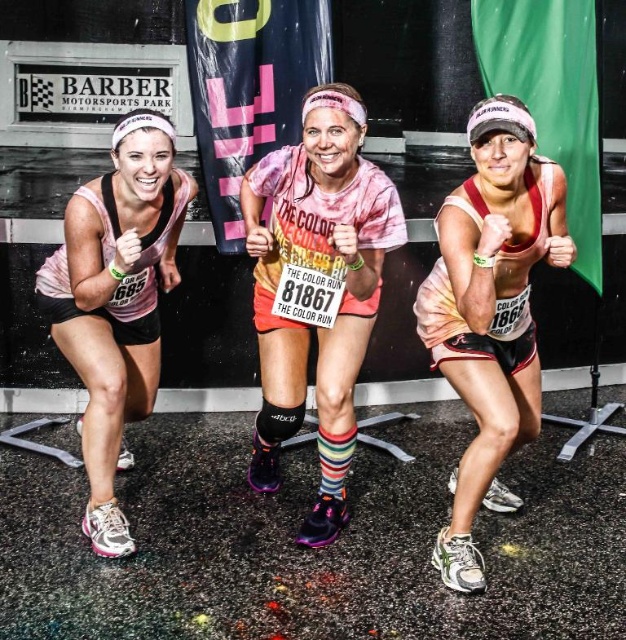
Is matte tie-dye tank top at center behind pink tie-dye tank top at left?

No.

Does matte tie-dye tank top at center have a lesser width compared to pink tie-dye tank top at left?

Yes.

Locate an element on the screen. The width and height of the screenshot is (626, 640). matte tie-dye tank top at center is located at coordinates (490, 312).

Consider the image. Who is shorter, multicolored striped socks at center or pink tie-dye tank top at left?

With less height is pink tie-dye tank top at left.

From the picture: Between multicolored striped socks at center and pink tie-dye tank top at left, which one has more height?

With more height is multicolored striped socks at center.

Is point (361, 195) positioned behind point (98, 250)?

Yes, it is.

This screenshot has width=626, height=640. Find the location of `multicolored striped socks at center`. multicolored striped socks at center is located at coordinates (326, 273).

Can you confirm if matte tie-dye tank top at center is positioned above multicolored striped socks at center?

No.

Between point (463, 372) and point (322, 486), which one is positioned in front?

Positioned in front is point (463, 372).

Where is `matte tie-dye tank top at center`? This screenshot has height=640, width=626. matte tie-dye tank top at center is located at coordinates (490, 312).